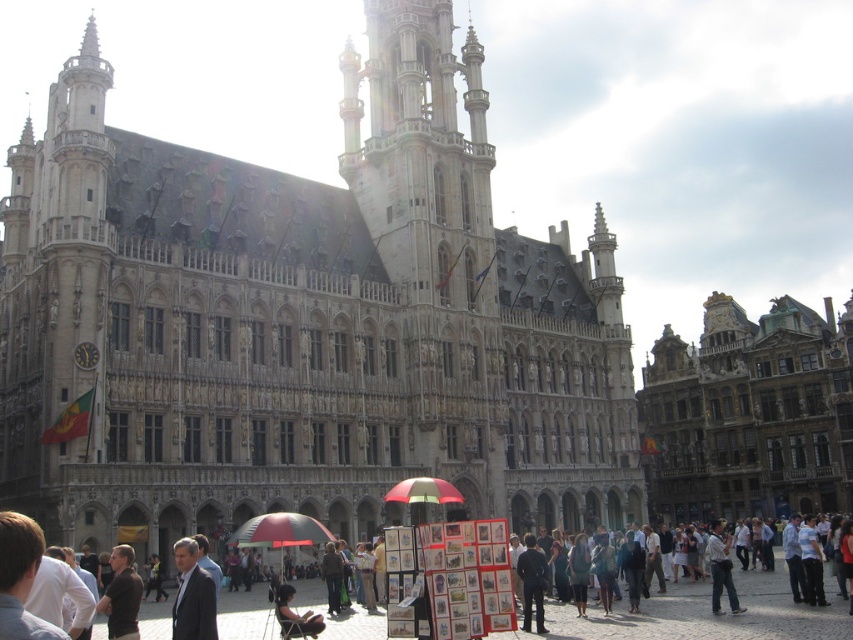
Question: Among these objects, which one is farthest from the camera?

Choices:
 (A) dark brown leather jacket at center
 (B) golden stone building at right
 (C) dark gray suit at lower left

Answer: (B)

Question: Based on their relative distances, which object is farther from the golden stone building at right?

Choices:
 (A) light brown leather jacket at center
 (B) dark blue jeans at center

Answer: (B)

Question: Which point is farther to the camera?

Choices:
 (A) dark blue jeans at center
 (B) light brown leather jacket at center
 (C) red and white striped umbrella at center

Answer: (B)

Question: Can you confirm if dark gray clothing at lower right is thinner than dark brown leather jacket at lower center?

Choices:
 (A) no
 (B) yes

Answer: (A)

Question: Is the position of stone gothic building at center less distant than that of dark gray suit at lower left?

Choices:
 (A) no
 (B) yes

Answer: (A)

Question: Does golden stone building at right appear over light brown leather jacket at center?

Choices:
 (A) yes
 (B) no

Answer: (A)